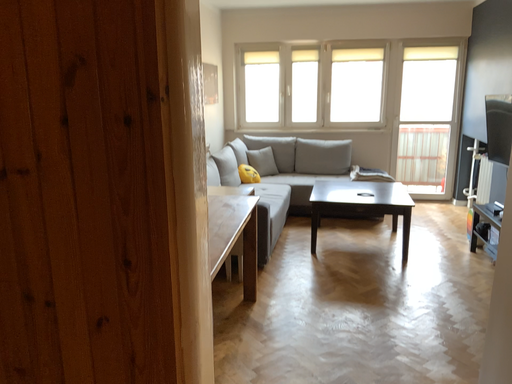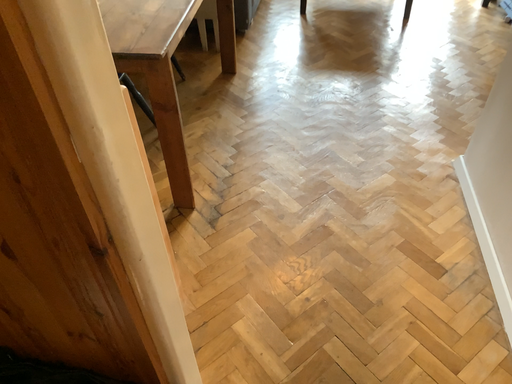
Question: Which way did the camera rotate in the video?

Choices:
 (A) rotated downward
 (B) rotated upward

Answer: (A)